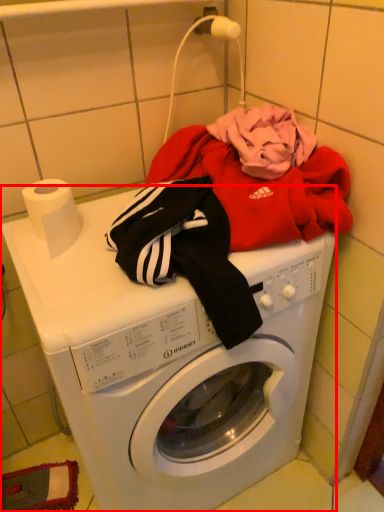
Question: From the image's perspective, what is the correct spatial relationship of washing machine (annotated by the red box) in relation to toilet paper?

Choices:
 (A) below
 (B) above

Answer: (A)